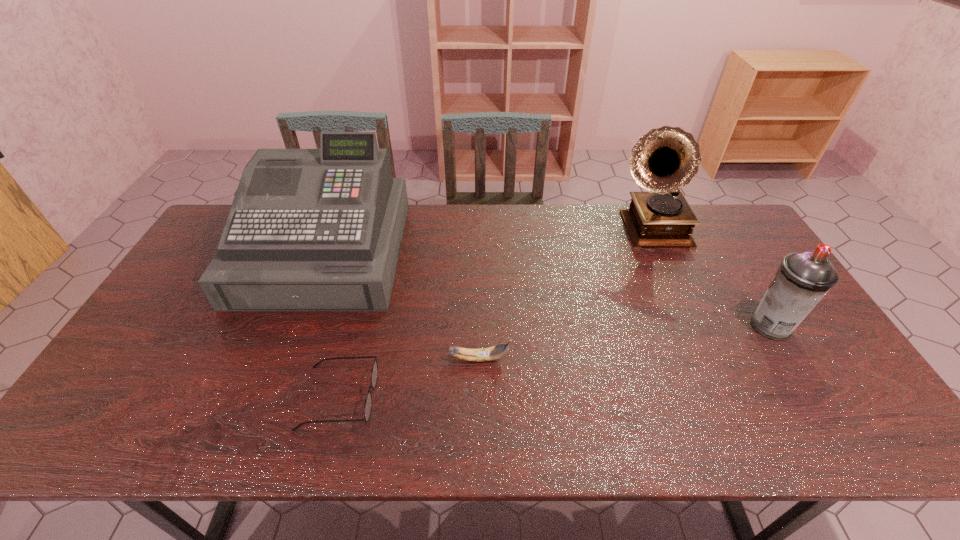
Locate an element on the screen. vacant space that's between the cash register and the banana is located at coordinates (402, 305).

The width and height of the screenshot is (960, 540). Find the location of `free space between the fourth tallest object and the nearest object`. free space between the fourth tallest object and the nearest object is located at coordinates (409, 378).

The image size is (960, 540). I want to click on vacant space in between the fourth farthest object and the shortest object, so click(409, 378).

Choose which object is the second nearest neighbor to the rightmost object. Please provide its 2D coordinates. Your answer should be formatted as a tuple, i.e. [(x, y)], where the tuple contains the x and y coordinates of a point satisfying the conditions above.

[(490, 353)]

Identify which object is the second closest to the record player. Please provide its 2D coordinates. Your answer should be formatted as a tuple, i.e. [(x, y)], where the tuple contains the x and y coordinates of a point satisfying the conditions above.

[(490, 353)]

The image size is (960, 540). In order to click on vacant space that satisfies the following two spatial constraints: 1. on the horn of the rightmost object; 2. on the left side of the second object from right to left in this screenshot , I will do `click(693, 326)`.

You are a GUI agent. You are given a task and a screenshot of the screen. Output one action in this format:
    pyautogui.click(x=<x>, y=<y>)
    Task: Click on the vacant region that satisfies the following two spatial constraints: 1. on the front-facing side of the aerosol can; 2. on the right side of the cash register
    
    Given the screenshot: What is the action you would take?
    pyautogui.click(x=296, y=326)

You are a GUI agent. You are given a task and a screenshot of the screen. Output one action in this format:
    pyautogui.click(x=<x>, y=<y>)
    Task: Click on the vacant space that satisfies the following two spatial constraints: 1. on the horn of the record player; 2. on the front-facing side of the shortest object
    The width and height of the screenshot is (960, 540).
    Given the screenshot: What is the action you would take?
    pyautogui.click(x=725, y=397)